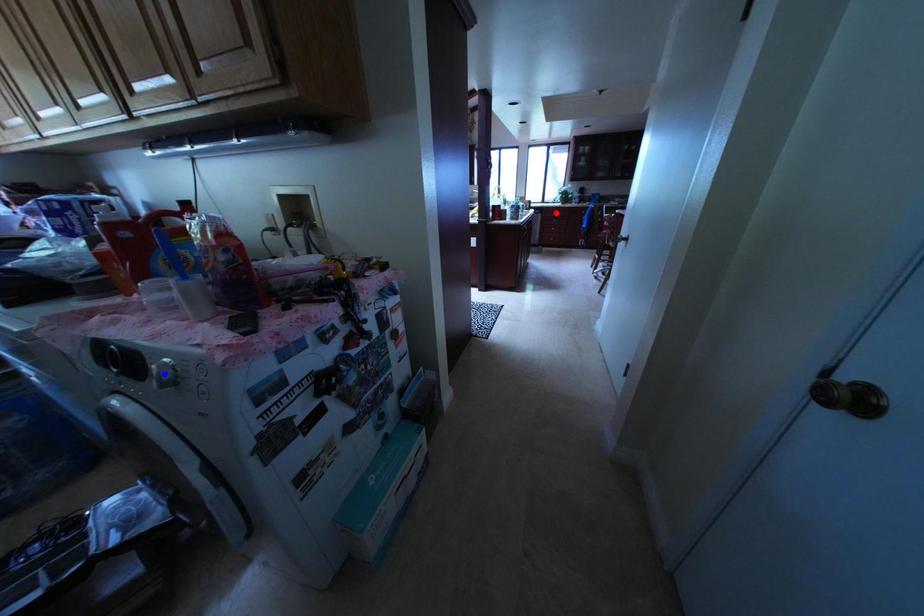
Question: Which of the two points in the image is closer to the camera?

Choices:
 (A) Blue point is closer.
 (B) Red point is closer.

Answer: (A)